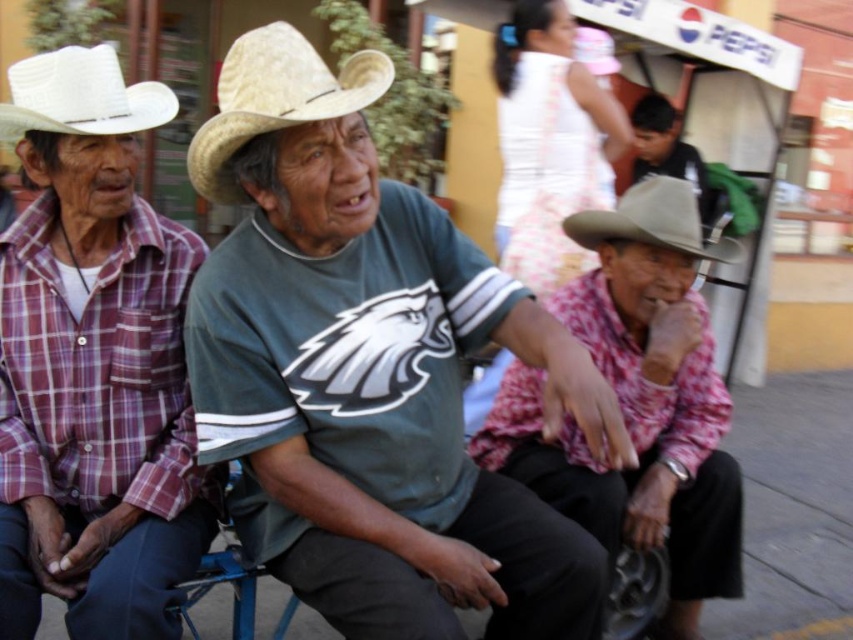
Question: Does straw hat at center have a lesser width compared to gray felt cowboy hat at lower right?

Choices:
 (A) no
 (B) yes

Answer: (B)

Question: Among these objects, which one is nearest to the camera?

Choices:
 (A) plaid fabric shirt at right
 (B) smooth gray hat at upper right

Answer: (A)

Question: Can you confirm if plaid fabric shirt at left is positioned above gray felt cowboy hat at lower right?

Choices:
 (A) yes
 (B) no

Answer: (B)

Question: Is white straw cowboy hat at upper left smaller than smooth gray hat at upper right?

Choices:
 (A) yes
 (B) no

Answer: (A)

Question: Which point appears farthest from the camera in this image?

Choices:
 (A) click(260, 100)
 (B) click(38, 492)

Answer: (B)

Question: Which point is farther from the camera taking this photo?

Choices:
 (A) (669, 186)
 (B) (16, 534)

Answer: (A)